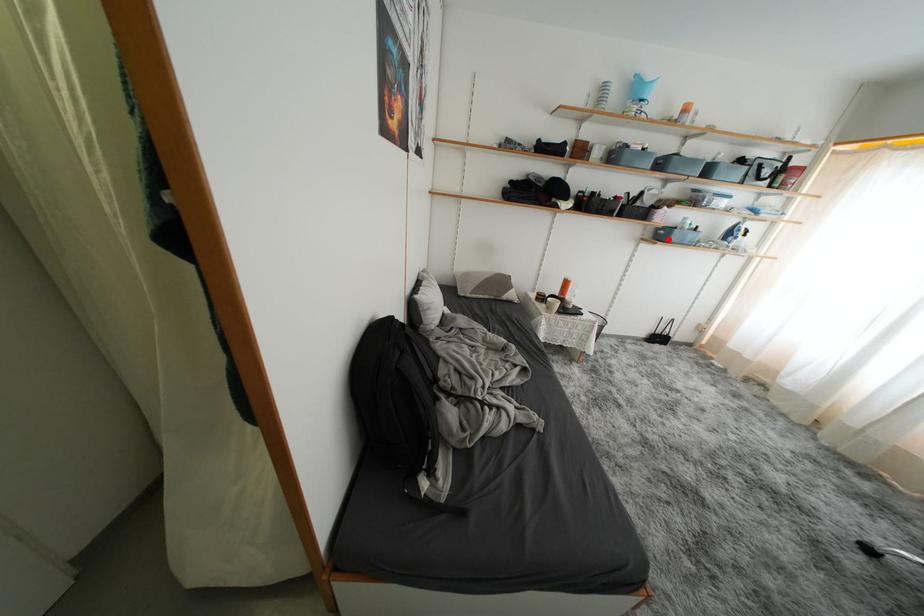
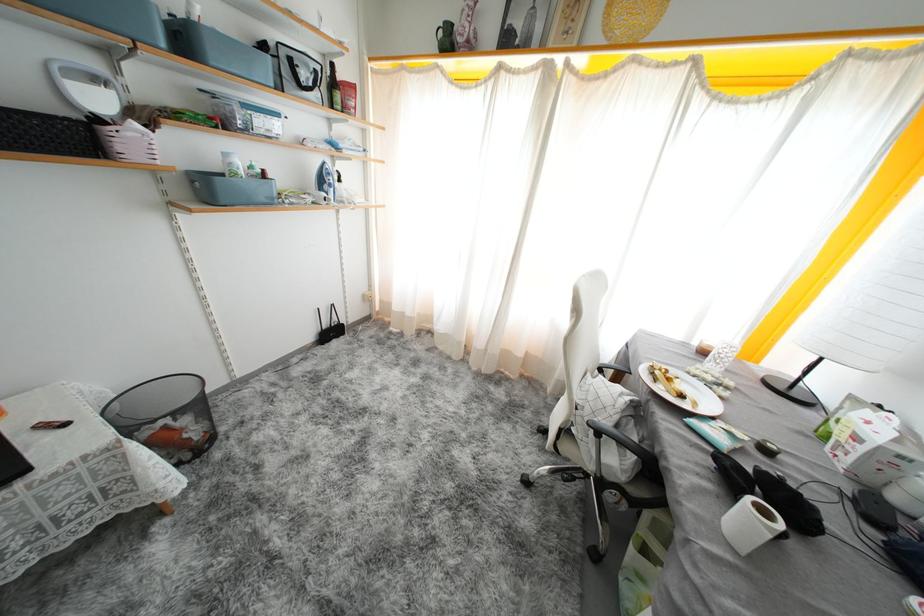
Where in the second image is the point corresponding to the highlighted location from the first image?

(215, 196)